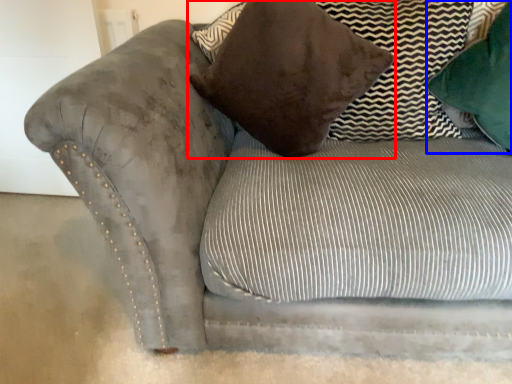
Question: Among these objects, which one is nearest to the camera, pillow (highlighted by a red box) or pillow (highlighted by a blue box)?

Choices:
 (A) pillow
 (B) pillow

Answer: (A)